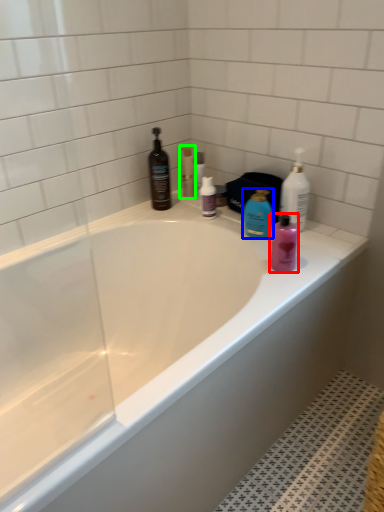
Question: Which object is positioned closest to toiletry (highlighted by a red box)? Select from cleaning product (highlighted by a blue box) and toiletry (highlighted by a green box).

Choices:
 (A) cleaning product
 (B) toiletry

Answer: (A)